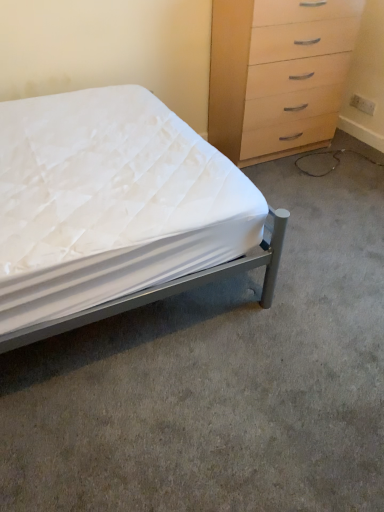
Identify the location of spots to the right of metallic gray bed at left. The image size is (384, 512). (323, 252).